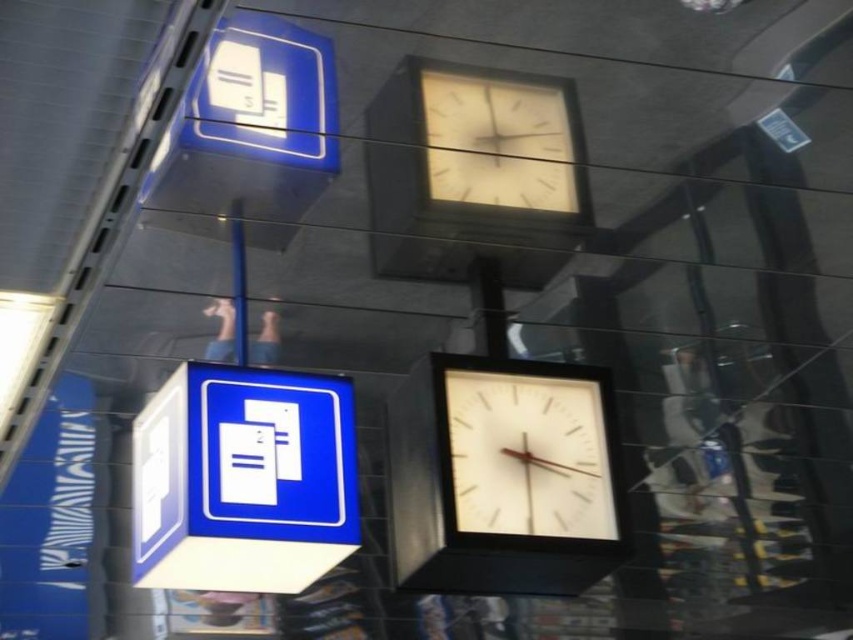
You are standing in a train station and want to reach the blue glossy sign at upper left. If you can walk 1.5 meters per second, how many seconds will it take you to reach it?

The blue glossy sign at upper left is 2.87 meters away. At a walking speed of 1.5 meters per second, it would take approximately 1.91 seconds to reach it.

Consider the image. You are standing in the train station and want to check the time on both the white matte clock at upper center and the metallic pole at center. Which clock is closer to you?

The white matte clock at upper center is in front of the metallic pole at center, so it is closer to you.